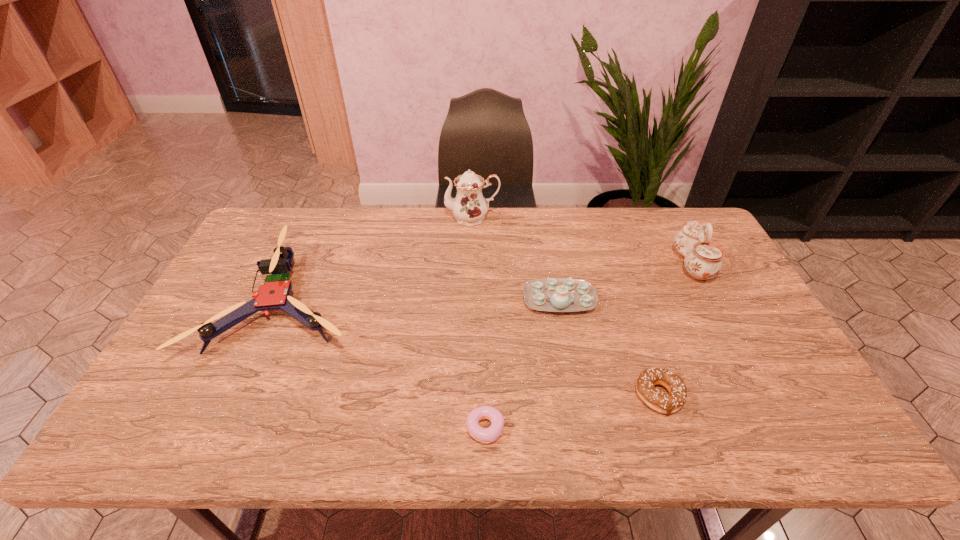
This screenshot has width=960, height=540. I want to click on object located in the left edge section of the desktop, so click(274, 293).

Identify the location of object that is at the right edge. (702, 260).

What are the coordinates of `object present at the far left corner` in the screenshot? It's located at (274, 293).

This screenshot has height=540, width=960. What are the coordinates of `object at the far right corner` in the screenshot? It's located at (702, 260).

This screenshot has height=540, width=960. Find the location of `blank area at the far edge`. blank area at the far edge is located at coordinates (428, 225).

Image resolution: width=960 pixels, height=540 pixels. What are the coordinates of `free point at the near edge` in the screenshot? It's located at (687, 436).

Image resolution: width=960 pixels, height=540 pixels. I want to click on free space at the left edge of the desktop, so click(180, 382).

You are a GUI agent. You are given a task and a screenshot of the screen. Output one action in this format:
    pyautogui.click(x=<x>, y=<y>)
    Task: Click on the vacant space at the far left corner
    
    Given the screenshot: What is the action you would take?
    coord(284,218)

You are a GUI agent. You are given a task and a screenshot of the screen. Output one action in this format:
    pyautogui.click(x=<x>, y=<y>)
    Task: Click on the vacant region at the far right corner
    
    Given the screenshot: What is the action you would take?
    pyautogui.click(x=697, y=219)

The height and width of the screenshot is (540, 960). Identify the location of unoccupied area between the taller doughnut and the rightmost chinaware. (676, 330).